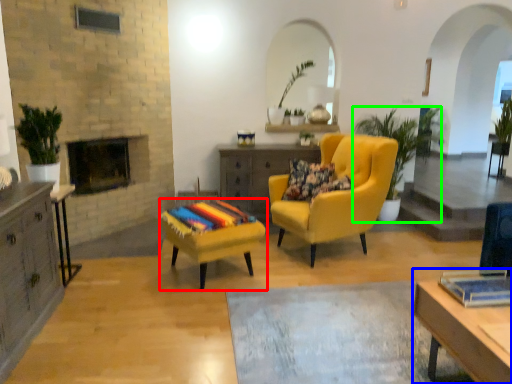
Question: Considering the real-world distances, which object is closest to stool (highlighted by a red box)? desk (highlighted by a blue box) or houseplant (highlighted by a green box).

Choices:
 (A) desk
 (B) houseplant

Answer: (A)